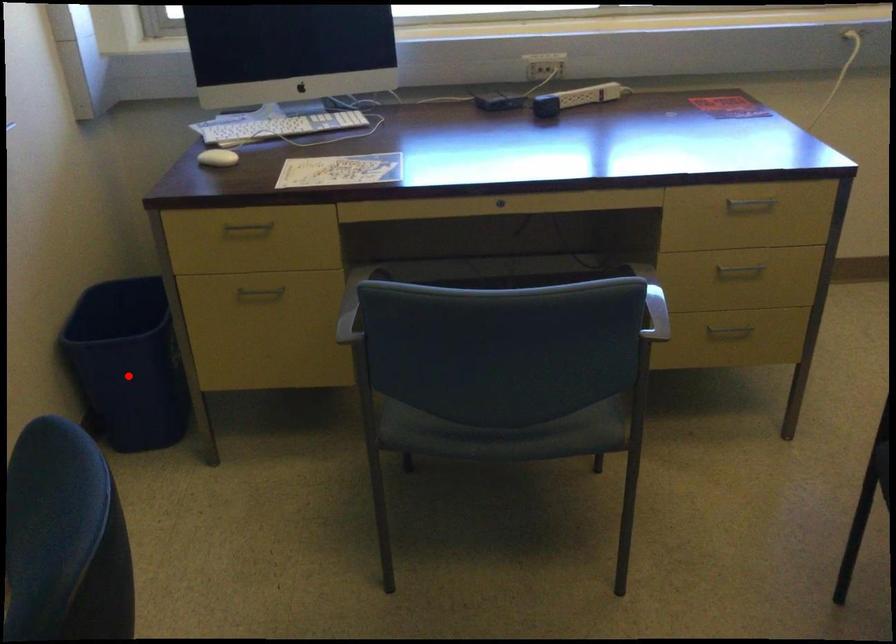
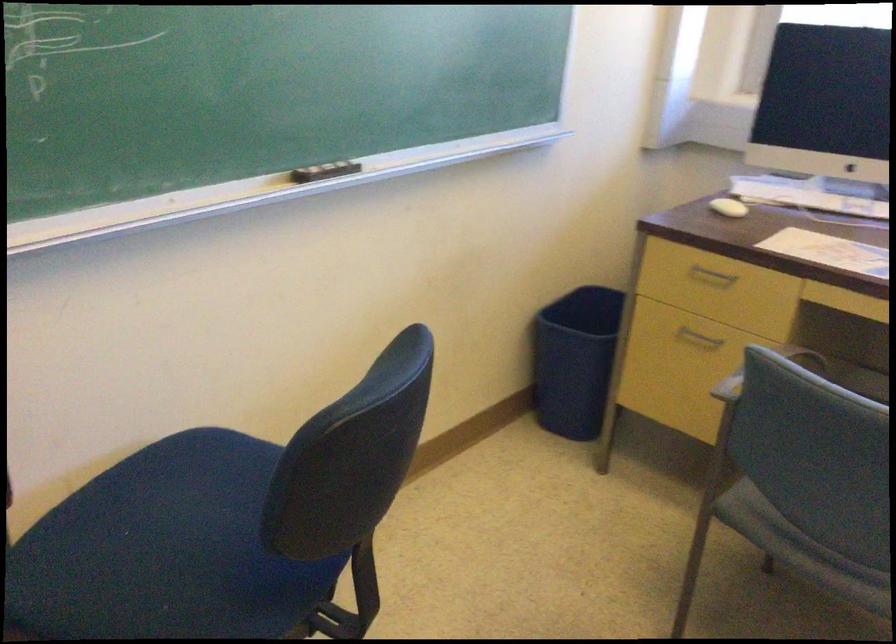
In the second image, find the point that corresponds to the highlighted location in the first image.

(574, 360)